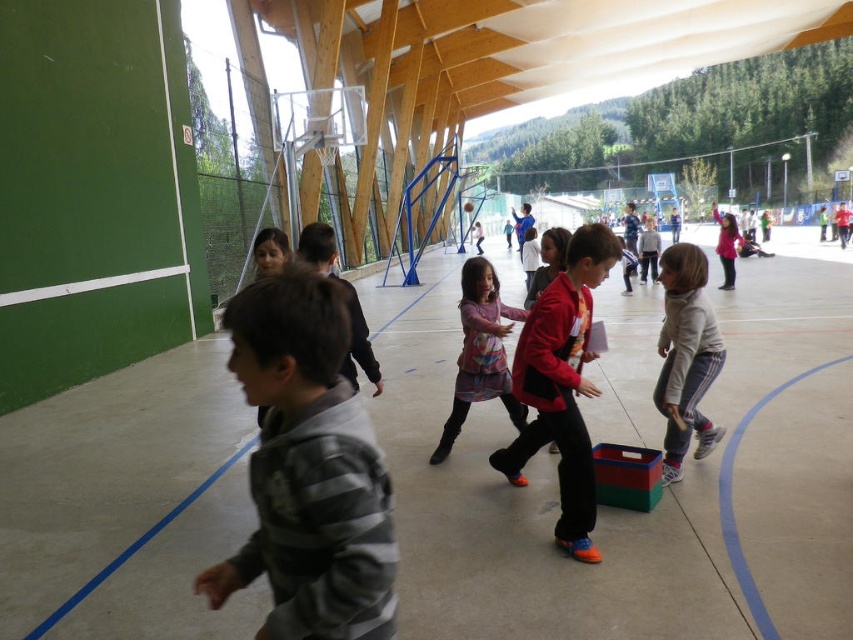
Question: Which point is closer to the camera?

Choices:
 (A) striped cotton shirt at center
 (B) matte pink sweater at center

Answer: (A)

Question: Can you confirm if red matte jacket at center is thinner than multicolored fabric dress at center?

Choices:
 (A) yes
 (B) no

Answer: (A)

Question: Which object is farther from the camera taking this photo?

Choices:
 (A) striped cotton shirt at center
 (B) red matte jacket at center
 (C) white fleece jacket at center
 (D) multicolored fabric dress at center

Answer: (D)

Question: Where is striped cotton shirt at center located in relation to red matte jacket at center in the image?

Choices:
 (A) left
 (B) right

Answer: (A)

Question: Which object is positioned closest to the striped cotton shirt at center?

Choices:
 (A) white fleece jacket at center
 (B) matte pink sweater at center
 (C) multicolored fabric dress at center

Answer: (C)

Question: Does white fleece jacket at center appear on the left side of multicolored fabric dress at center?

Choices:
 (A) yes
 (B) no

Answer: (B)